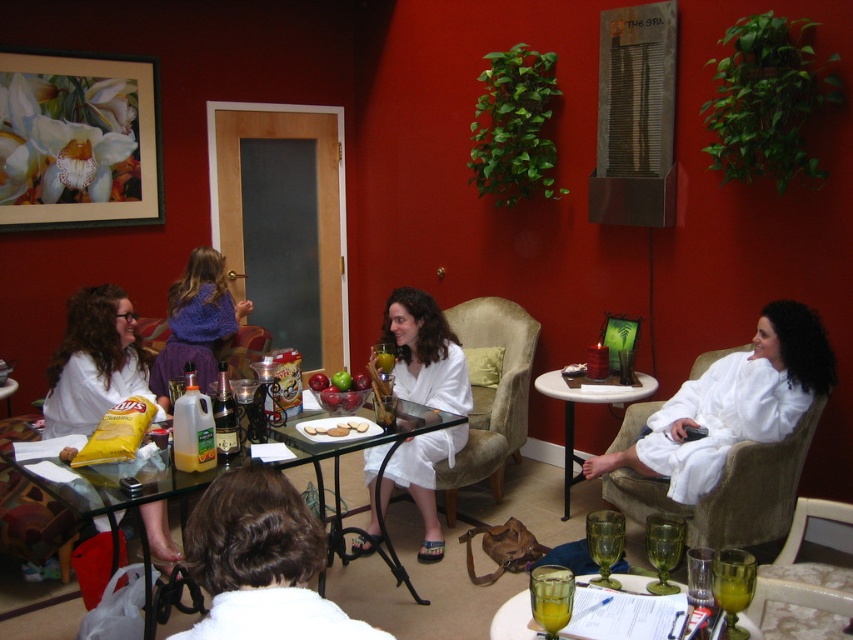
Question: From the image, what is the correct spatial relationship of transparent glass table at center in relation to yellow plastic jug at lower left?

Choices:
 (A) below
 (B) above

Answer: (A)

Question: Estimate the real-world distances between objects in this image. Which object is closer to the white matte bathrobe at center?

Choices:
 (A) shiny red apples at center
 (B) translucent glass table at lower center
 (C) purple knitted sweater at left

Answer: (A)

Question: Where is smooth chocolate bar at center located in relation to shiny red apples at center in the image?

Choices:
 (A) above
 (B) below

Answer: (A)

Question: Among these objects, which one is farthest from the camera?

Choices:
 (A) clear glass table at center
 (B) velvet beige armchair at lower right

Answer: (A)

Question: Which object appears closest to the camera in this image?

Choices:
 (A) matte glass table at center
 (B) translucent plastic bottle at center table
 (C) smooth chocolate bar at center
 (D) transparent glass table at center

Answer: (D)

Question: In this image, where is white bathrobe at lower center located relative to white plush armchair at right?

Choices:
 (A) above
 (B) below

Answer: (A)